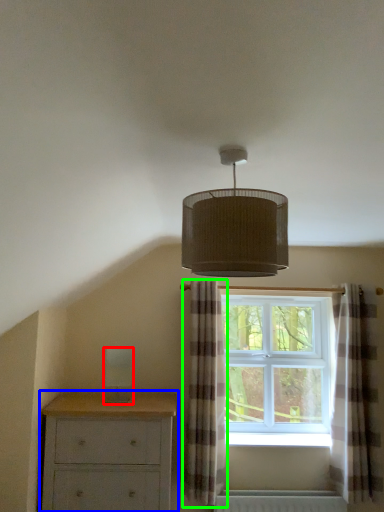
Question: Which object is the farthest from light fixture (highlighted by a red box)? Choose among these: chest of drawers (highlighted by a blue box) or curtain (highlighted by a green box).

Choices:
 (A) chest of drawers
 (B) curtain

Answer: (B)